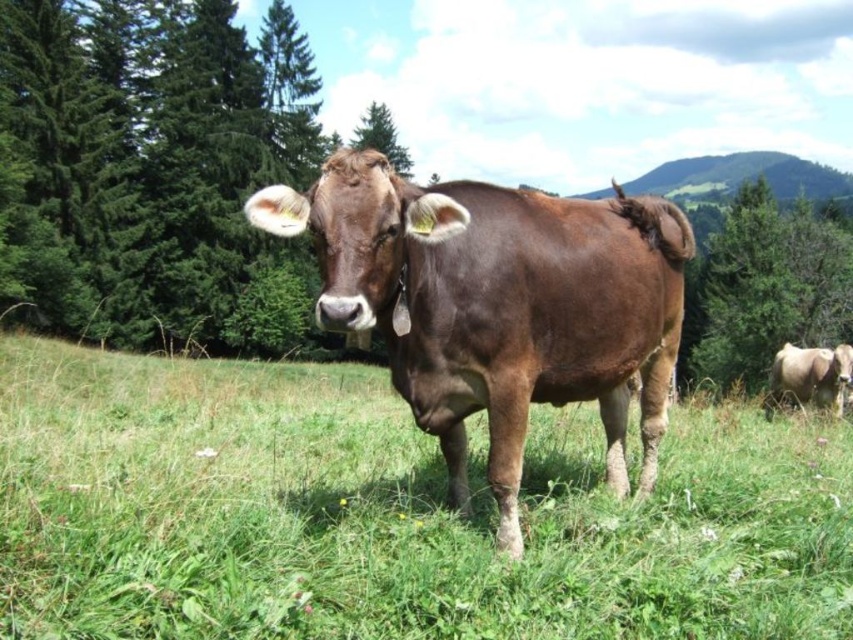
You are a photographer standing in the meadow and want to capture both the cow and the distant trees in your shot. You notice two points in your viewfinder labeled as point 1 at coordinates point (x=20, y=209) and point 2 at coordinates point (x=807, y=205). Which point is closer to you?

Point 1 at coordinates point (x=20, y=209) is closer to you than point 2 at coordinates point (x=807, y=205).

From the picture: You are a drone operator trying to capture the cow in the meadow. You have two points marked on your map for camera positioning. The first point is at point (491, 284) and the second is at point (831, 365). If you want to position the camera closer to the cow, which point should you choose?

Point (491, 284) is in front of point (831, 365), so you should choose point (491, 284) to position the camera closer to the cow.